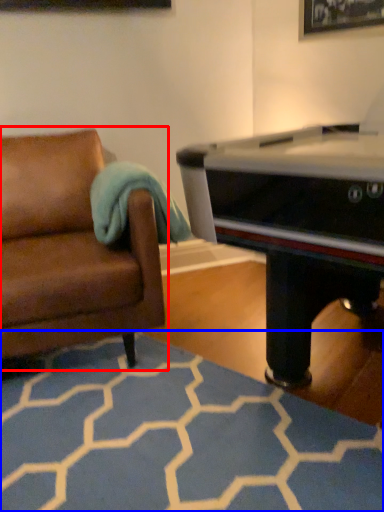
Question: Among these objects, which one is nearest to the camera, studio couch (highlighted by a red box) or plain (highlighted by a blue box)?

Choices:
 (A) studio couch
 (B) plain

Answer: (B)